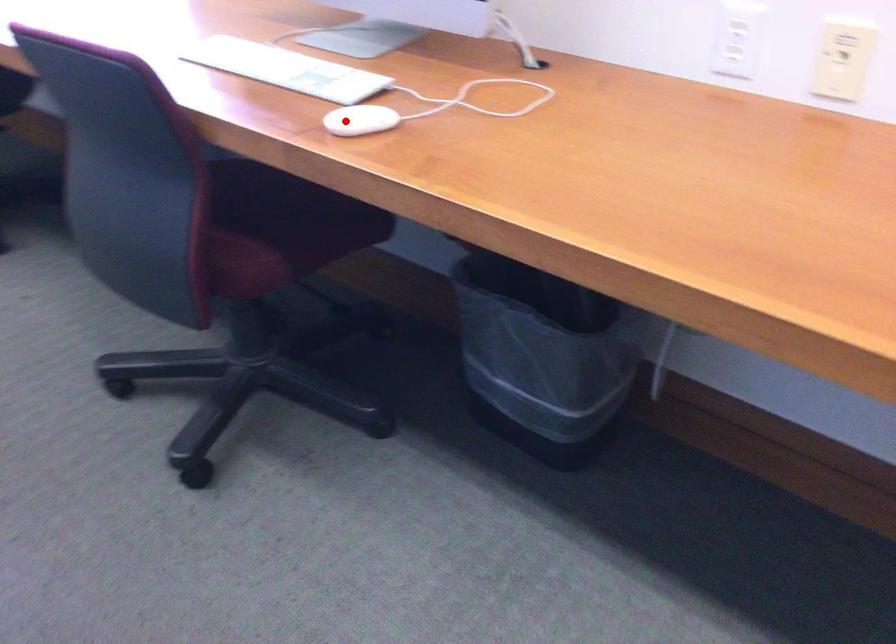
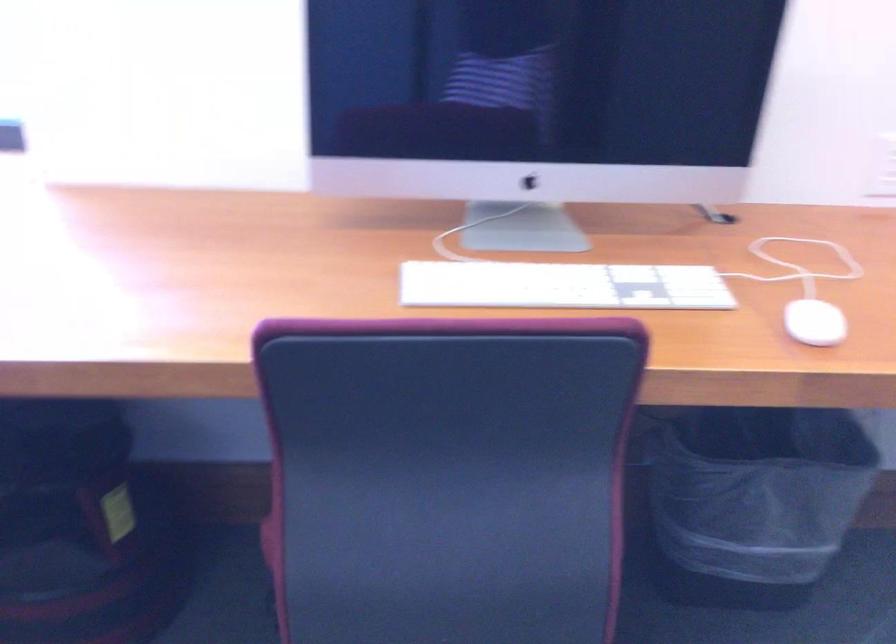
Question: I am providing you with two images of the same scene from different viewpoints. A red point is shown in image1. For the corresponding object point in image2, is it positioned nearer or farther from the camera?

Choices:
 (A) Nearer
 (B) Farther

Answer: (A)